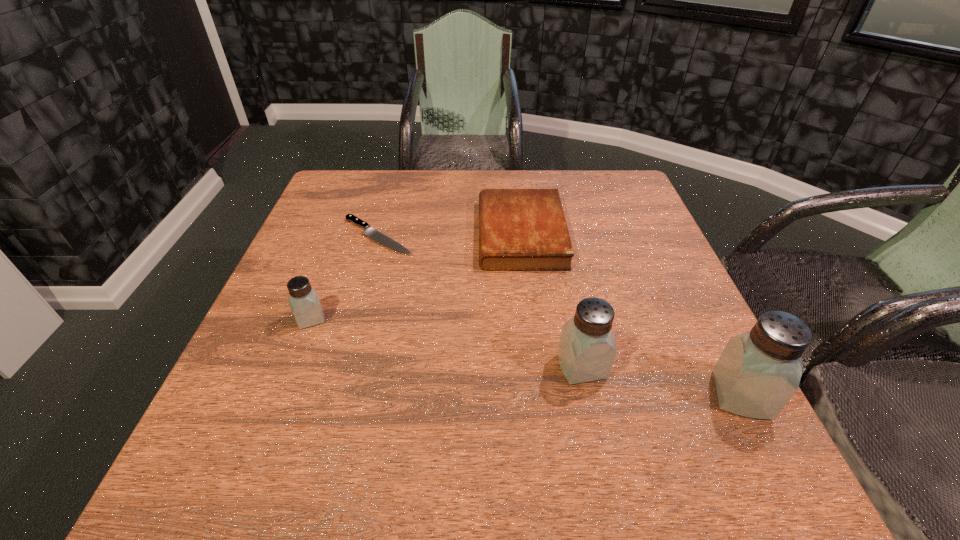
Locate an element on the screen. vacant space that satisfies the following two spatial constraints: 1. on the spine side of the rightmost saltshaker; 2. on the left side of the Bible is located at coordinates (540, 395).

Where is `free space that satisfies the following two spatial constraints: 1. on the spine side of the fourth shortest object; 2. on the left side of the Bible`? The height and width of the screenshot is (540, 960). free space that satisfies the following two spatial constraints: 1. on the spine side of the fourth shortest object; 2. on the left side of the Bible is located at coordinates (537, 367).

Locate an element on the screen. The image size is (960, 540). free space that satisfies the following two spatial constraints: 1. on the spine side of the fourth tallest object; 2. on the front side of the farthest saltshaker is located at coordinates (531, 319).

This screenshot has width=960, height=540. Identify the location of free location that satisfies the following two spatial constraints: 1. on the back side of the third shortest object; 2. on the left side of the steak knife. (343, 236).

You are a GUI agent. You are given a task and a screenshot of the screen. Output one action in this format:
    pyautogui.click(x=<x>, y=<y>)
    Task: Click on the free space that satisfies the following two spatial constraints: 1. on the spine side of the fourth shortest object; 2. on the right side of the Bible
    
    Given the screenshot: What is the action you would take?
    pyautogui.click(x=537, y=367)